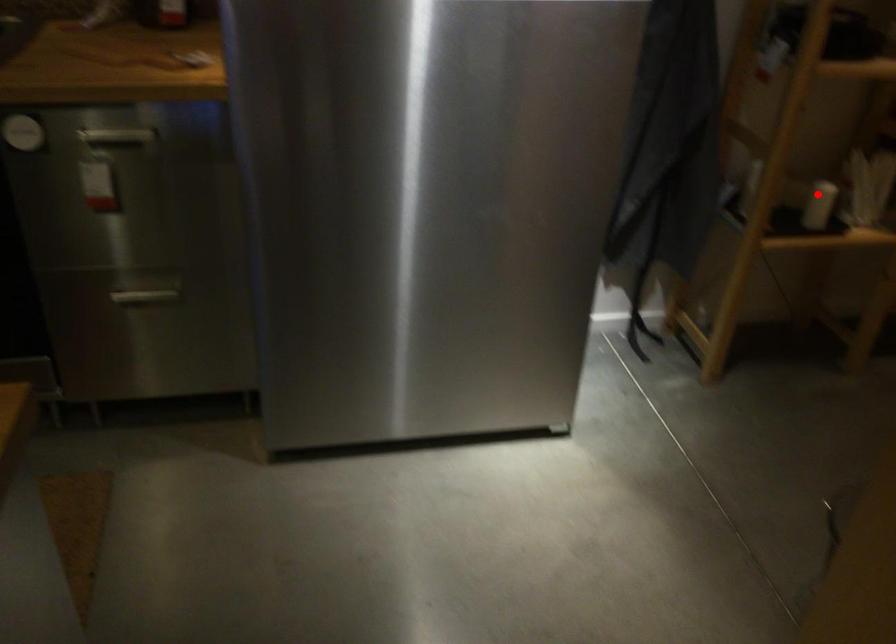
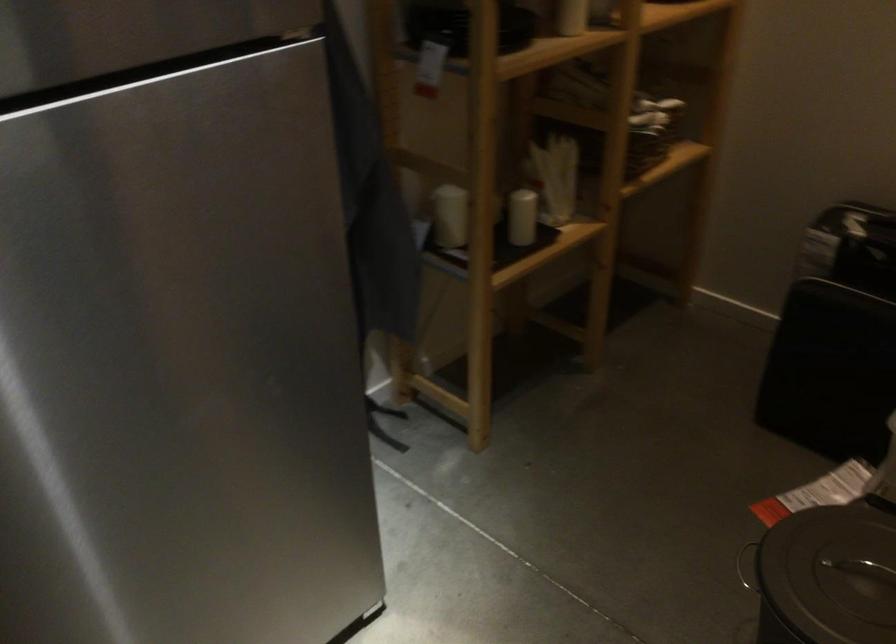
Question: I am providing you with two images of the same scene from different viewpoints. Image1 has a red point marked. In image2, the corresponding 3D location appears at what relative position? Reply with the corresponding letter.

Choices:
 (A) Closer
 (B) Farther

Answer: (A)